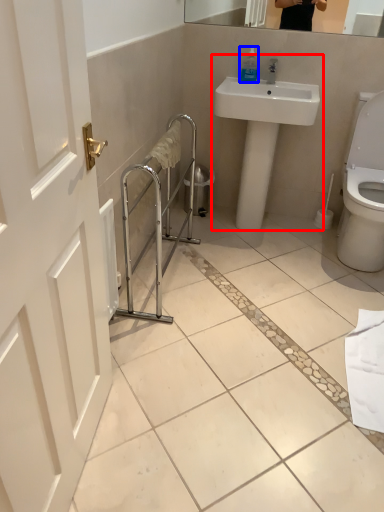
Question: Among these objects, which one is farthest to the camera, sink (highlighted by a red box) or soap dispenser (highlighted by a blue box)?

Choices:
 (A) sink
 (B) soap dispenser

Answer: (B)